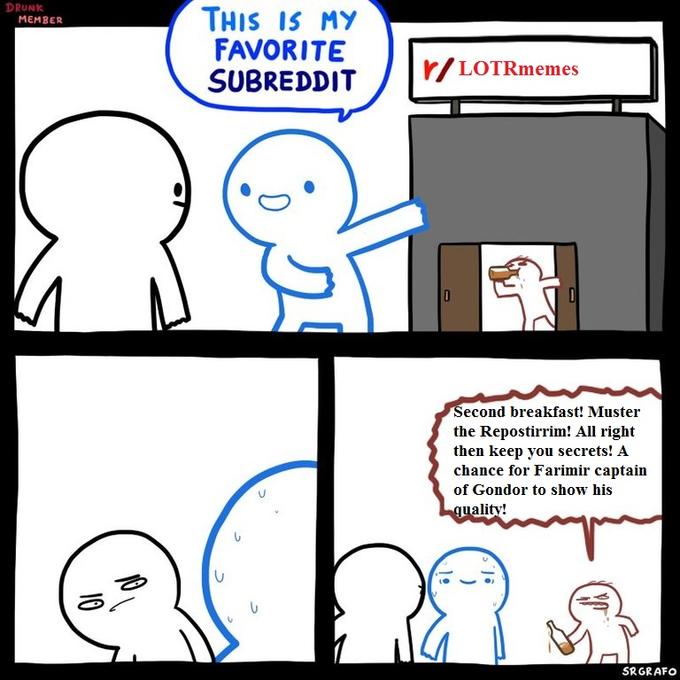
Where is `bottle`? Image resolution: width=680 pixels, height=680 pixels. bottle is located at coordinates (561, 638), (498, 273).